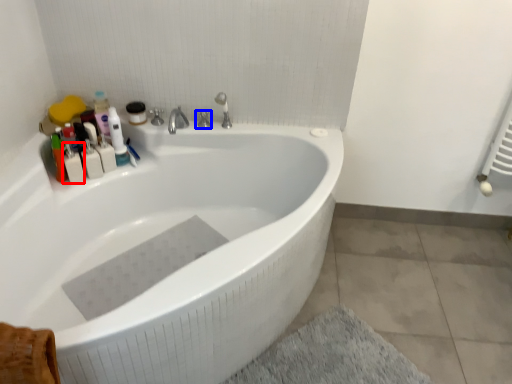
Question: Which object appears closest to the camera in this image, toiletry (highlighted by a red box) or tap (highlighted by a blue box)?

Choices:
 (A) toiletry
 (B) tap

Answer: (A)